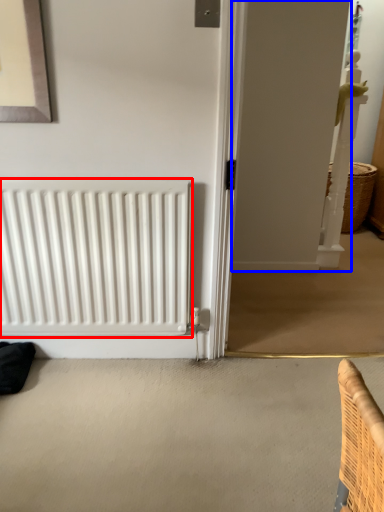
Question: Which object is closer to the camera taking this photo, radiator (highlighted by a red box) or screen door (highlighted by a blue box)?

Choices:
 (A) radiator
 (B) screen door

Answer: (B)